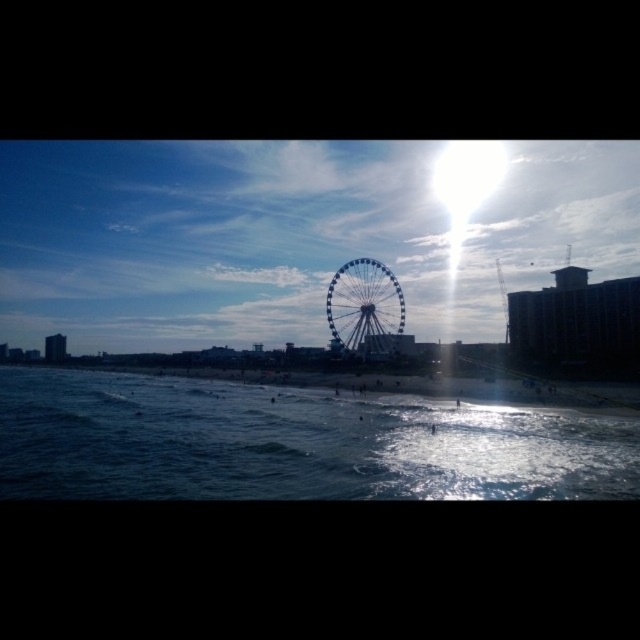
Question: Does dark blue water at lower center have a larger size compared to silver metallic ferris wheel at center?

Choices:
 (A) no
 (B) yes

Answer: (B)

Question: Is dark blue water at lower center further to the viewer compared to silver metallic ferris wheel at center?

Choices:
 (A) yes
 (B) no

Answer: (B)

Question: Which point is closer to the camera?

Choices:
 (A) dark blue water at lower center
 (B) silver metallic ferris wheel at center

Answer: (A)

Question: Considering the relative positions of dark blue water at lower center and silver metallic ferris wheel at center in the image provided, where is dark blue water at lower center located with respect to silver metallic ferris wheel at center?

Choices:
 (A) left
 (B) right

Answer: (A)